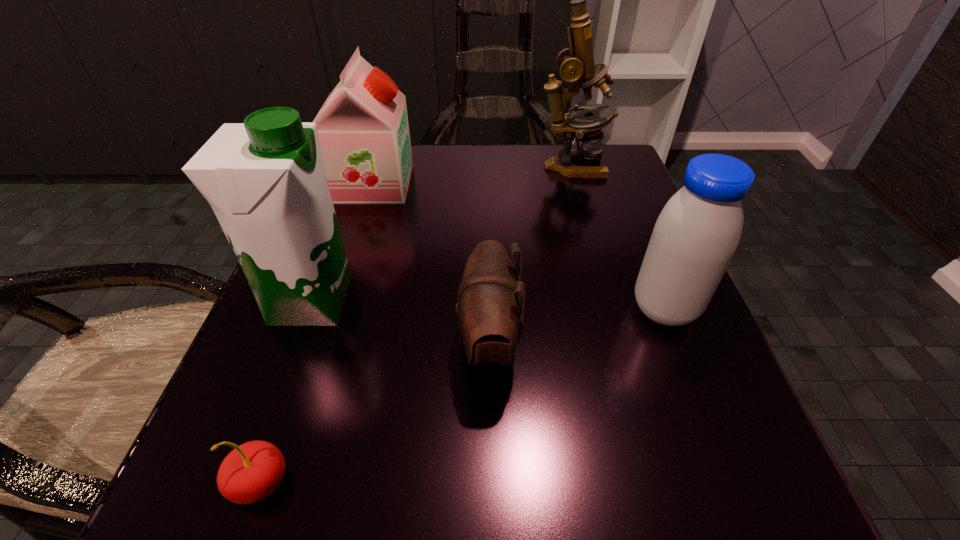
Point out which object is positioned as the third nearest to the cherry. Please provide its 2D coordinates. Your answer should be formatted as a tuple, i.e. [(x, y)], where the tuple contains the x and y coordinates of a point satisfying the conditions above.

[(698, 231)]

Select which object appears as the third closest to the second shortest object. Please provide its 2D coordinates. Your answer should be formatted as a tuple, i.e. [(x, y)], where the tuple contains the x and y coordinates of a point satisfying the conditions above.

[(251, 472)]

Locate which soya milk is the closest to the farthest soya milk. Please provide its 2D coordinates. Your answer should be formatted as a tuple, i.e. [(x, y)], where the tuple contains the x and y coordinates of a point satisfying the conditions above.

[(265, 180)]

Find the location of a particular element. The height and width of the screenshot is (540, 960). the closest soya milk to the farthest soya milk is located at coordinates (265, 180).

I want to click on free space that satisfies the following two spatial constraints: 1. on the back side of the nearest object; 2. on the front-facing side of the tallest soya milk, so click(x=324, y=301).

Identify the location of vacant space that satisfies the following two spatial constraints: 1. on the front-facing side of the rightmost soya milk; 2. on the right side of the tallest soya milk. (308, 309).

Where is `free space in the image that satisfies the following two spatial constraints: 1. on the front side of the microscope; 2. on the front-facing side of the tallest soya milk`? This screenshot has height=540, width=960. free space in the image that satisfies the following two spatial constraints: 1. on the front side of the microscope; 2. on the front-facing side of the tallest soya milk is located at coordinates (610, 301).

The height and width of the screenshot is (540, 960). In order to click on free space that satisfies the following two spatial constraints: 1. on the front-facing side of the tallest soya milk; 2. on the right side of the shortest object in this screenshot , I will do `click(243, 482)`.

Locate an element on the screen. vacant space that satisfies the following two spatial constraints: 1. with the cap open on the rightmost soya milk; 2. on the right side of the farthest soya milk is located at coordinates (332, 309).